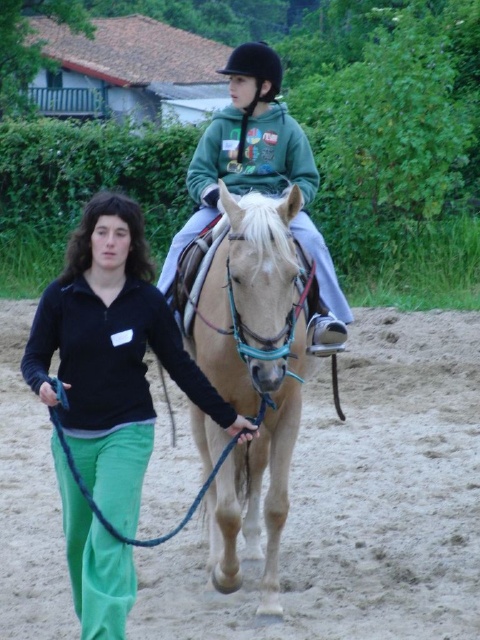
Question: Does light brown leather horse at center appear on the left side of green fleece jacket at center?

Choices:
 (A) no
 (B) yes

Answer: (B)

Question: Does brown sandy dirt field at center appear over green fleece jacket at center?

Choices:
 (A) no
 (B) yes

Answer: (A)

Question: Can you confirm if brown sandy dirt field at center is bigger than green fleece jacket at center?

Choices:
 (A) yes
 (B) no

Answer: (B)

Question: Which of the following is the farthest from the observer?

Choices:
 (A) green fleece jacket at center
 (B) matte black jacket at center
 (C) light brown leather horse at center

Answer: (A)

Question: Which point is closer to the camera?

Choices:
 (A) green fleece jacket at center
 (B) brown sandy dirt field at center

Answer: (B)

Question: Among these points, which one is farthest from the camera?

Choices:
 (A) (243, 252)
 (B) (149, 284)
 (C) (441, 493)

Answer: (C)